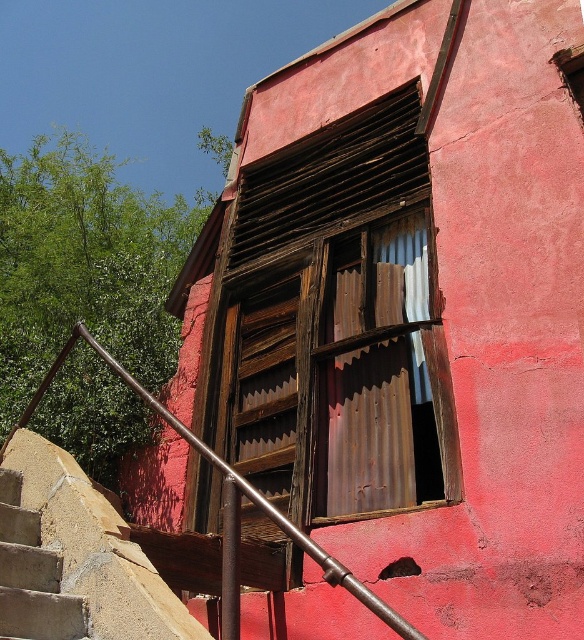
You are standing at the base of the concrete textured stairs at lower left and want to reach the rusty metal window at center. Which direction should you move to get closer to the window?

You should move forward towards the rusty metal window at center since it is closer to you than the concrete textured stairs at lower left.